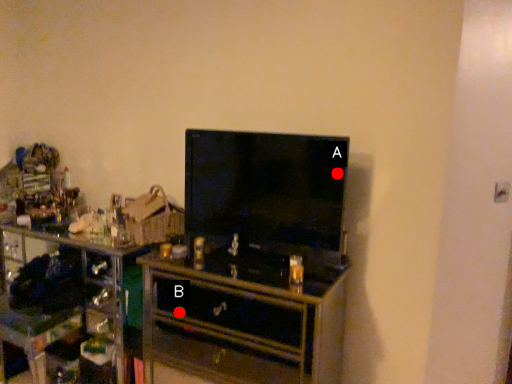
Question: Two points are circled on the image, labeled by A and B beside each circle. Which point is closer to the camera?

Choices:
 (A) A is closer
 (B) B is closer

Answer: (A)